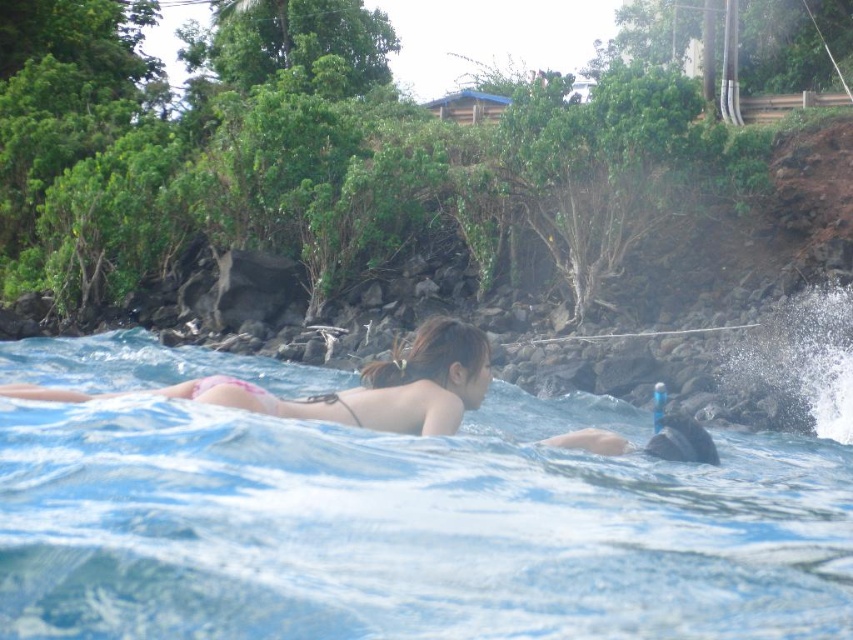
Is clear blue water at center to the right of pink bikini at center from the viewer's perspective?

Incorrect, clear blue water at center is not on the right side of pink bikini at center.

Is clear blue water at center to the left of pink bikini at center from the viewer's perspective?

Yes, clear blue water at center is to the left of pink bikini at center.

I want to click on clear blue water at center, so click(425, 522).